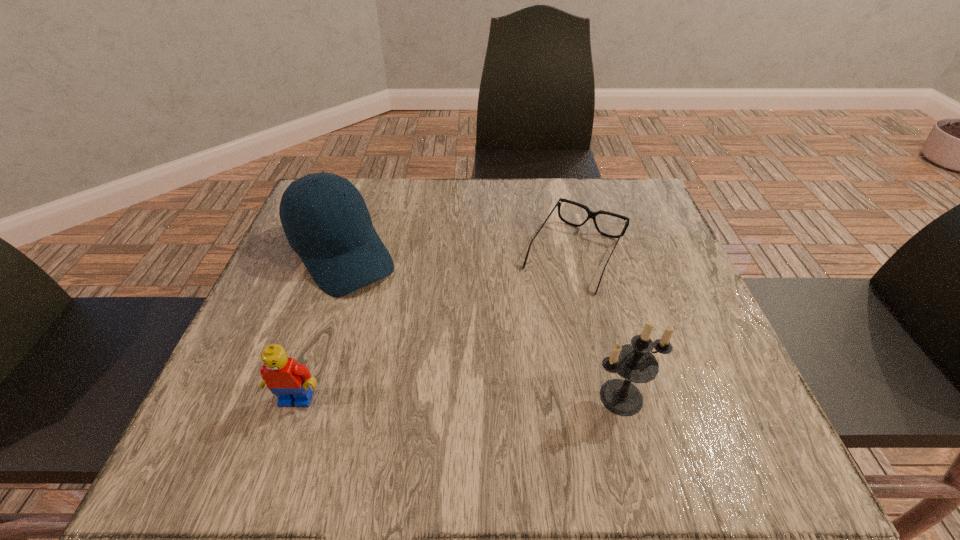
Choose which object is the second nearest neighbor to the Lego. Please provide its 2D coordinates. Your answer should be formatted as a tuple, i.e. [(x, y)], where the tuple contains the x and y coordinates of a point satisfying the conditions above.

[(591, 214)]